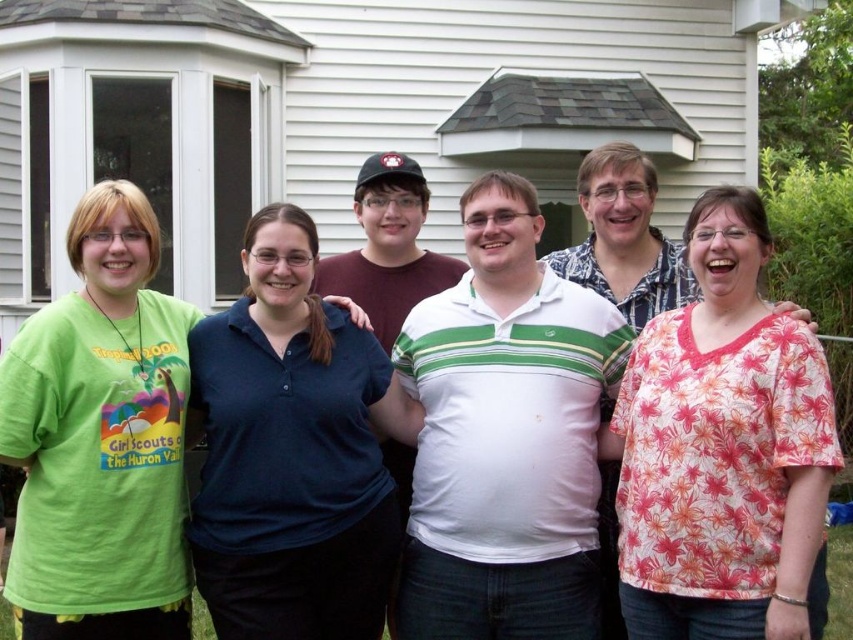
Is floral print blouse at center smaller than dark blue polo shirt at center?

Correct, floral print blouse at center occupies less space than dark blue polo shirt at center.

Can you confirm if floral print blouse at center is wider than dark blue polo shirt at center?

Incorrect, floral print blouse at center's width does not surpass dark blue polo shirt at center's.

Identify the location of floral print blouse at center. This screenshot has height=640, width=853. (724, 451).

The width and height of the screenshot is (853, 640). I want to click on floral print blouse at center, so coord(724,451).

The width and height of the screenshot is (853, 640). Find the location of `floral print blouse at center`. floral print blouse at center is located at coordinates (724, 451).

Is point (827, 380) positioned before point (149, 320)?

That is True.

The image size is (853, 640). Identify the location of floral print blouse at center. (724, 451).

Where is `floral print blouse at center`? The width and height of the screenshot is (853, 640). floral print blouse at center is located at coordinates (724, 451).

Which of these two, dark blue polo shirt at center or green cotton t-shirt at left, stands taller?

Standing taller between the two is green cotton t-shirt at left.

Does point (280, 362) come behind point (138, 584)?

Yes, it is behind point (138, 584).

Between point (221, 584) and point (73, 429), which one is positioned behind?

The point (221, 584) is more distant.

At what (x,y) coordinates should I click in order to perform the action: click on dark blue polo shirt at center. Please return your answer as a coordinate pair (x, y). Looking at the image, I should click on (289, 452).